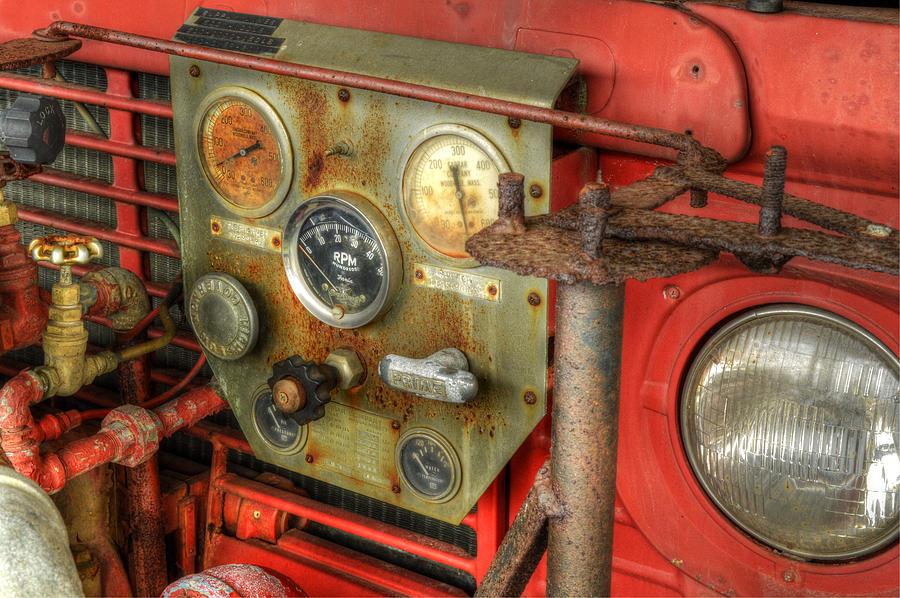
Locate an element on the screen. The image size is (900, 598). black plastic knobs is located at coordinates (319, 387), (33, 126).